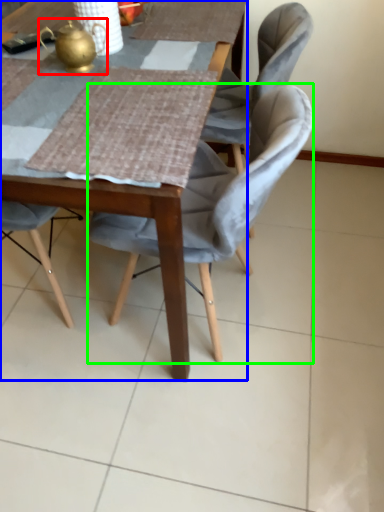
Question: Which is nearer to the tea pot (highlighted by a red box)? table (highlighted by a blue box) or chair (highlighted by a green box).

Choices:
 (A) table
 (B) chair

Answer: (B)